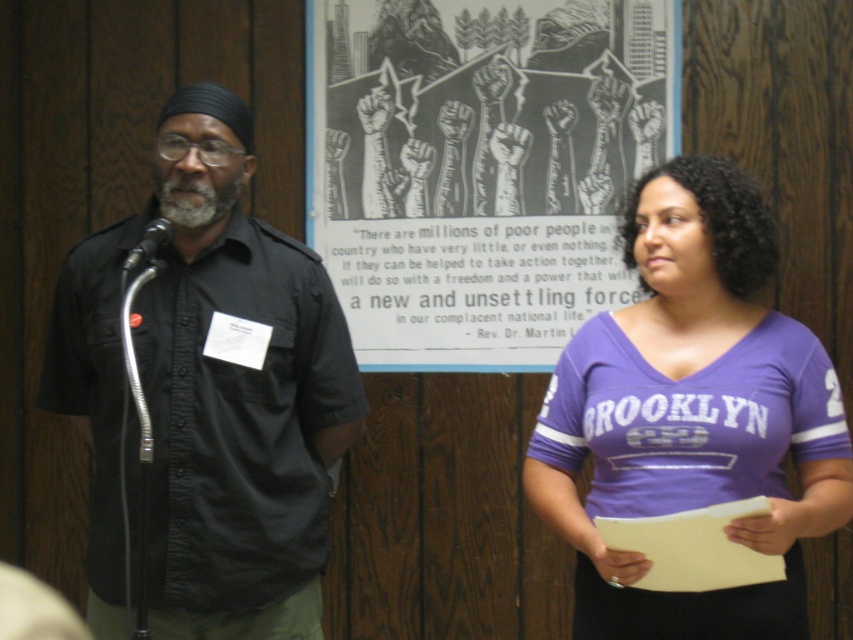
Who is more forward, (177, 346) or (149, 230)?

Point (149, 230) is more forward.

How far apart are black matte shirt at center and black metallic microphone at left?

black matte shirt at center and black metallic microphone at left are 11.85 inches apart from each other.

Is point (195, 589) positioned behind point (125, 275)?

That is True.

Image resolution: width=853 pixels, height=640 pixels. I want to click on black matte shirt at center, so click(x=209, y=394).

Does black and white print at center appear on the right side of black metallic microphone at left?

Yes, black and white print at center is to the right of black metallic microphone at left.

How distant is black and white print at center from black metallic microphone at left?

black and white print at center is 1.10 meters away from black metallic microphone at left.

Is point (552, 24) closer to viewer compared to point (132, 256)?

That is False.

The width and height of the screenshot is (853, 640). Find the location of `black and white print at center`. black and white print at center is located at coordinates (480, 166).

Is black and white print at center wider than black matte shirt at center?

Indeed, black and white print at center has a greater width compared to black matte shirt at center.

Based on the photo, does black and white print at center appear on the left side of black matte shirt at center?

No, black and white print at center is not to the left of black matte shirt at center.

Where is `black and white print at center`? The image size is (853, 640). black and white print at center is located at coordinates (480, 166).